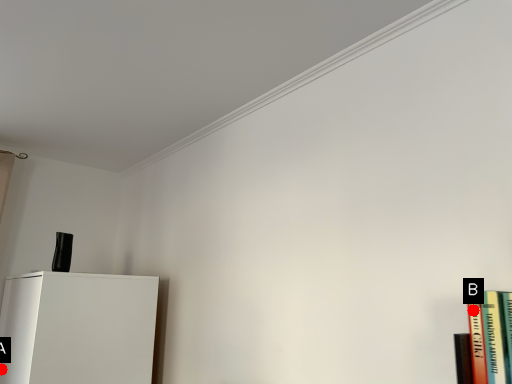
Question: Two points are circled on the image, labeled by A and B beside each circle. Which point is farther to the camera?

Choices:
 (A) A is further
 (B) B is further

Answer: (A)